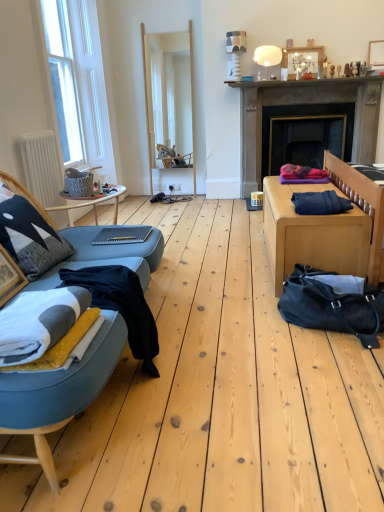
Question: Does knitted fabric pillow at left lie in front of wooden picture frame at upper right, which is the first picture frame in back-to-front order?

Choices:
 (A) no
 (B) yes

Answer: (B)

Question: From the image's perspective, is knitted fabric pillow at left under wooden picture frame at upper right, which is the second picture frame in bottom-to-top order?

Choices:
 (A) yes
 (B) no

Answer: (A)

Question: Is knitted fabric pillow at left wider than wooden picture frame at upper right, which is the 2th picture frame from front to back?

Choices:
 (A) yes
 (B) no

Answer: (A)

Question: Considering the relative positions of knitted fabric pillow at left and wooden picture frame at upper right, which is the 2th picture frame from front to back, in the image provided, is knitted fabric pillow at left to the right of wooden picture frame at upper right, which is the 2th picture frame from front to back, from the viewer's perspective?

Choices:
 (A) yes
 (B) no

Answer: (B)

Question: From a real-world perspective, is knitted fabric pillow at left positioned over wooden picture frame at upper right, which is the first picture frame in back-to-front order, based on gravity?

Choices:
 (A) no
 (B) yes

Answer: (A)

Question: Could wooden picture frame at upper right, which is the second picture frame in bottom-to-top order, be considered to be inside knitted fabric pillow at left?

Choices:
 (A) yes
 (B) no

Answer: (B)

Question: Is white wooden window at left outside of wooden table at right, which appears as the 1th table when viewed from the right?

Choices:
 (A) yes
 (B) no

Answer: (A)

Question: Is white wooden window at left beside wooden table at right, which appears as the 1th table when viewed from the right?

Choices:
 (A) no
 (B) yes

Answer: (A)

Question: From the image's perspective, is white wooden window at left over wooden table at right, which appears as the 1th table when viewed from the right?

Choices:
 (A) no
 (B) yes

Answer: (B)

Question: From a real-world perspective, is white wooden window at left over wooden table at right, the 2th table in the left-to-right sequence?

Choices:
 (A) no
 (B) yes

Answer: (B)

Question: From the image's perspective, is white wooden window at left under wooden table at right, the 2th table in the left-to-right sequence?

Choices:
 (A) yes
 (B) no

Answer: (B)

Question: Is the depth of white wooden window at left less than that of wooden table at right, the 2th table in the left-to-right sequence?

Choices:
 (A) no
 (B) yes

Answer: (A)

Question: Is matte gray table at center, which ranks as the first table in left-to-right order, positioned with its back to knitted fabric pillow at left?

Choices:
 (A) yes
 (B) no

Answer: (B)